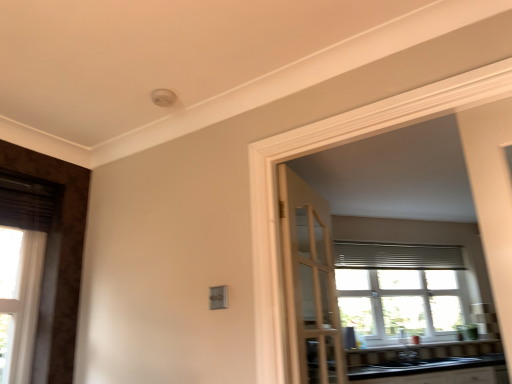
Based on the photo, measure the distance between point [457,253] and camera.

Point [457,253] is 15.47 feet away from camera.

The height and width of the screenshot is (384, 512). I want to click on black glossy sink at lower center, which is the 2th sink in left-to-right order, so click(423, 365).

Looking at this image, from a real-world perspective, is black glossy sink at lower center, the first sink positioned from the right, located beneath white wood door at left, which appears as the 2th door when viewed from the right?

Yes, from a real-world perspective, black glossy sink at lower center, the first sink positioned from the right, is under white wood door at left, which appears as the 2th door when viewed from the right.

Does point (440, 359) come closer to viewer compared to point (67, 193)?

No, (440, 359) is further to viewer.

What's the angular difference between black glossy sink at lower center, the first sink positioned from the right, and white wood door at left, which appears as the 2th door when viewed from the right,'s facing directions?

There is a 33.9-degree angle between the facing directions of black glossy sink at lower center, the first sink positioned from the right, and white wood door at left, which appears as the 2th door when viewed from the right.

From the image's perspective, would you say black glossy sink at lower center, which is the 2th sink in left-to-right order, is positioned over white wood door at left, which appears as the 2th door when viewed from the right?

No, from the image's perspective, black glossy sink at lower center, which is the 2th sink in left-to-right order, is not above white wood door at left, which appears as the 2th door when viewed from the right.

Is silver metallic blinds at upper center not close to white wood door at left, which appears as the first door when viewed from the left?

silver metallic blinds at upper center is positioned a significant distance from white wood door at left, which appears as the first door when viewed from the left.

From a real-world perspective, is silver metallic blinds at upper center positioned above or below white wood door at left, which appears as the first door when viewed from the left?

In terms of real-world spatial position, silver metallic blinds at upper center is above white wood door at left, which appears as the first door when viewed from the left.

This screenshot has width=512, height=384. I want to click on curtain below the white wood door at left, which appears as the first door when viewed from the left (from the image's perspective), so click(x=397, y=256).

Can you confirm if silver metallic blinds at upper center is taller than white wood door at left, which appears as the first door when viewed from the left?

Incorrect, the height of silver metallic blinds at upper center is not larger of that of white wood door at left, which appears as the first door when viewed from the left.

From the image's perspective, is white glossy window sill at lower center below white glass window at center?

Indeed, from the image's perspective, white glossy window sill at lower center is shown beneath white glass window at center.

In the scene shown: Which of these two, white glossy window sill at lower center or white glass window at center, stands taller?

Standing taller between the two is white glass window at center.

What's the angular difference between white glossy window sill at lower center and white glass window at center's facing directions?

The angle between the facing direction of white glossy window sill at lower center and the facing direction of white glass window at center is 0.154 degrees.

From the image's perspective, who appears lower, black glossy sink at lower right, acting as the first sink starting from the left, or white glass window at center?

black glossy sink at lower right, acting as the first sink starting from the left, appears lower in the image.

From a real-world perspective, between black glossy sink at lower right, the second sink from the right, and white glass window at center, who is vertically higher?

In real-world perspective, white glass window at center is above.

Considering the relative sizes of black glossy sink at lower right, acting as the first sink starting from the left, and white glass window at center in the image provided, is black glossy sink at lower right, acting as the first sink starting from the left, thinner than white glass window at center?

No, black glossy sink at lower right, acting as the first sink starting from the left, is not thinner than white glass window at center.

Considering the relative positions of white glass window at center and light wood door at center, positioned as the second door in left-to-right order, in the image provided, is white glass window at center to the left of light wood door at center, positioned as the second door in left-to-right order, from the viewer's perspective?

Incorrect, white glass window at center is not on the left side of light wood door at center, positioned as the second door in left-to-right order.

Is white glass window at center placed right next to light wood door at center, positioned as the second door in left-to-right order?

There is a gap between white glass window at center and light wood door at center, positioned as the second door in left-to-right order.

How much distance is there between white glass window at center and light wood door at center, positioned as the second door in left-to-right order?

A distance of 3.64 feet exists between white glass window at center and light wood door at center, positioned as the second door in left-to-right order.

Considering the sizes of white glass window at center and light wood door at center, positioned as the second door in left-to-right order, in the image, is white glass window at center taller or shorter than light wood door at center, positioned as the second door in left-to-right order,?

white glass window at center is shorter than light wood door at center, positioned as the second door in left-to-right order.

Looking at their sizes, would you say light wood door at center, positioned as the second door in left-to-right order, is wider or thinner than white wood door at left, which appears as the first door when viewed from the left?

Considering their sizes, light wood door at center, positioned as the second door in left-to-right order, looks broader than white wood door at left, which appears as the first door when viewed from the left.

Which is in front, point (298, 253) or point (57, 242)?

The point (57, 242) is closer to the camera.

Between light wood door at center, acting as the 1th door starting from the right, and white wood door at left, which appears as the first door when viewed from the left, which one has smaller size?

Smaller between the two is white wood door at left, which appears as the first door when viewed from the left.

Which is in front, light wood door at center, acting as the 1th door starting from the right, or white wood door at left, which appears as the 2th door when viewed from the right?

light wood door at center, acting as the 1th door starting from the right, is more forward.

Considering the relative sizes of black glossy sink at lower center, the first sink positioned from the right, and white glossy window sill at lower center in the image provided, is black glossy sink at lower center, the first sink positioned from the right, shorter than white glossy window sill at lower center?

In fact, black glossy sink at lower center, the first sink positioned from the right, may be taller than white glossy window sill at lower center.

Do you think black glossy sink at lower center, which is the 2th sink in left-to-right order, is within white glossy window sill at lower center, or outside of it?

black glossy sink at lower center, which is the 2th sink in left-to-right order, is outside white glossy window sill at lower center.

Would you say black glossy sink at lower center, the first sink positioned from the right, is to the left or to the right of white glossy window sill at lower center in the picture?

In the image, black glossy sink at lower center, the first sink positioned from the right, appears on the left side of white glossy window sill at lower center.

Consider the image. Could you tell me if black glossy sink at lower center, the first sink positioned from the right, is turned towards white glossy window sill at lower center?

No.

Where is `the 2nd sink positioned below the white wood door at left, which appears as the 2th door when viewed from the right (from a real-world perspective)`? the 2nd sink positioned below the white wood door at left, which appears as the 2th door when viewed from the right (from a real-world perspective) is located at coordinates (423, 365).

Identify the location of curtain positioned vertically above the white wood door at left, which appears as the first door when viewed from the left (from a real-world perspective). (397, 256).

When comparing their distances from silver metallic blinds at upper center, does black glossy sink at lower center, which is the 2th sink in left-to-right order, or white glass window at center seem closer?

white glass window at center.

When comparing their distances from silver metallic blinds at upper center, does white glass window at center or black glossy sink at lower center, the first sink positioned from the right, seem further?

Based on the image, black glossy sink at lower center, the first sink positioned from the right, appears to be further to silver metallic blinds at upper center.

Based on their spatial positions, is black glossy sink at lower center, which is the 2th sink in left-to-right order, or silver metallic blinds at upper center closer to white wood door at left, which appears as the 2th door when viewed from the right?

black glossy sink at lower center, which is the 2th sink in left-to-right order, is positioned closer to the anchor white wood door at left, which appears as the 2th door when viewed from the right.

Based on their spatial positions, is white wood door at left, which appears as the first door when viewed from the left, or light wood door at center, acting as the 1th door starting from the right, closer to white glass window at center?

The object closer to white glass window at center is light wood door at center, acting as the 1th door starting from the right.

When comparing their distances from silver metallic blinds at upper center, does light wood door at center, acting as the 1th door starting from the right, or white wood door at left, which appears as the first door when viewed from the left, seem closer?

light wood door at center, acting as the 1th door starting from the right, is positioned closer to the anchor silver metallic blinds at upper center.

Which object lies nearer to the anchor point white glossy window sill at lower center, silver metallic blinds at upper center or white glass window at center?

white glass window at center is positioned closer to the anchor white glossy window sill at lower center.

Based on their spatial positions, is light wood door at center, acting as the 1th door starting from the right, or white glossy window sill at lower center further from silver metallic blinds at upper center?

light wood door at center, acting as the 1th door starting from the right, lies further to silver metallic blinds at upper center than the other object.

From the image, which object appears to be nearer to light wood door at center, positioned as the second door in left-to-right order, white glossy window sill at lower center or white wood door at left, which appears as the first door when viewed from the left?

Among the two, white glossy window sill at lower center is located nearer to light wood door at center, positioned as the second door in left-to-right order.

Locate an element on the screen. window between light wood door at center, acting as the 1th door starting from the right, and silver metallic blinds at upper center, along the z-axis is located at coordinates (401, 289).

You are a GUI agent. You are given a task and a screenshot of the screen. Output one action in this format:
    pyautogui.click(x=<x>, y=<y>)
    Task: Click on the window between silver metallic blinds at upper center and black glossy sink at lower right, acting as the first sink starting from the left, in the up-down direction
    The width and height of the screenshot is (512, 384).
    Given the screenshot: What is the action you would take?
    pyautogui.click(x=401, y=289)

You are a GUI agent. You are given a task and a screenshot of the screen. Output one action in this format:
    pyautogui.click(x=<x>, y=<y>)
    Task: Click on the sink positioned between black glossy sink at lower center, which is the 2th sink in left-to-right order, and white glossy window sill at lower center from near to far
    The width and height of the screenshot is (512, 384).
    Given the screenshot: What is the action you would take?
    pyautogui.click(x=401, y=355)

What are the coordinates of `window between white wood door at left, which appears as the 2th door when viewed from the right, and silver metallic blinds at upper center, in the horizontal direction` in the screenshot? It's located at (401, 289).